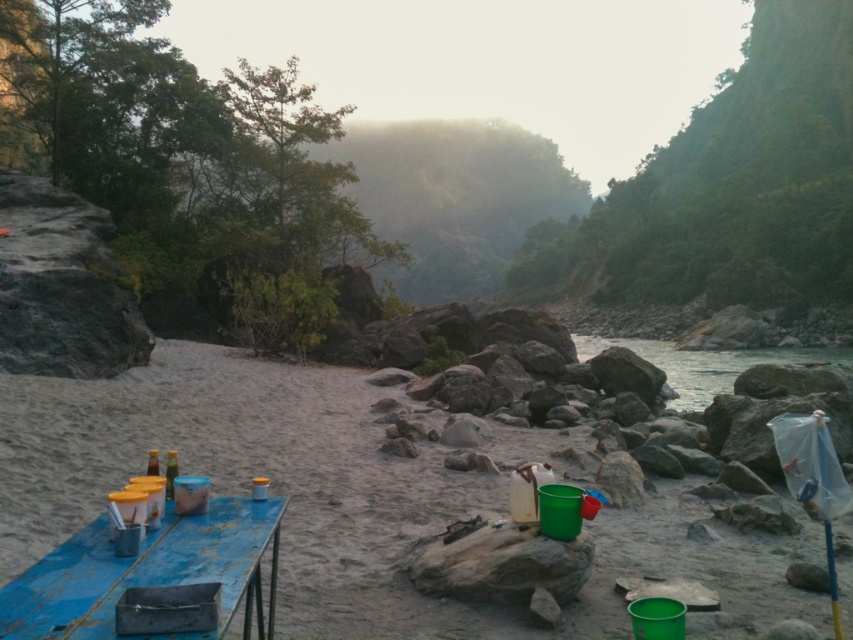
Question: Does blue painted wood picnic table at lower left appear on the right side of clear water at river right?

Choices:
 (A) no
 (B) yes

Answer: (A)

Question: Which of the following is the closest to the observer?

Choices:
 (A) (692, 374)
 (B) (347, 458)

Answer: (B)

Question: Considering the real-world distances, which object is farthest from the clear water at river right?

Choices:
 (A) blue painted wood picnic table at lower left
 (B) sandy beach at center

Answer: (A)

Question: Can you confirm if sandy beach at center is wider than clear water at river right?

Choices:
 (A) yes
 (B) no

Answer: (B)

Question: Does blue painted wood picnic table at lower left appear on the right side of clear water at river right?

Choices:
 (A) yes
 (B) no

Answer: (B)

Question: Which object is farther from the camera taking this photo?

Choices:
 (A) clear water at river right
 (B) sandy beach at center
 (C) blue painted wood picnic table at lower left

Answer: (A)